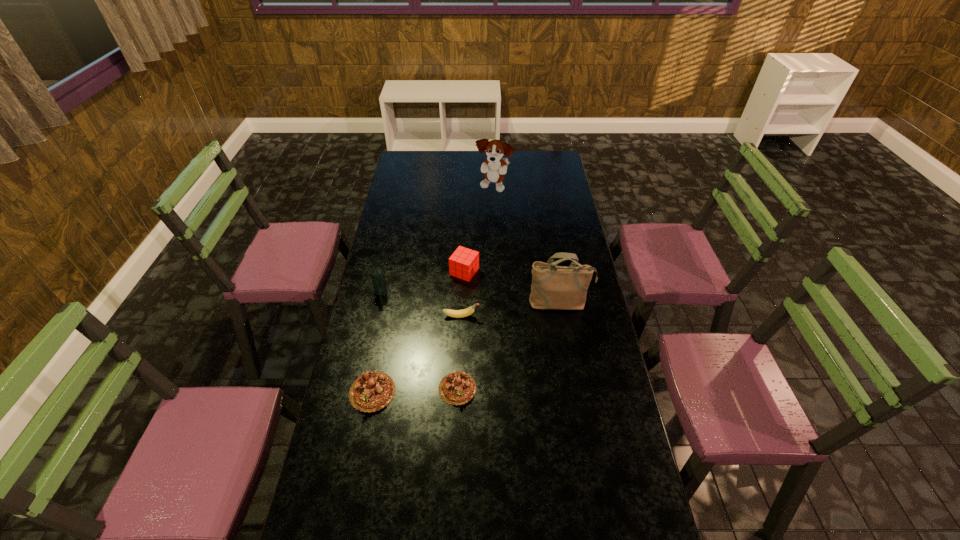
The chocolate cakes are evenly distributed in the image. To maintain this, where would you place another chocolate cake on the right? Please point to a free space. Please provide its 2D coordinates. Your answer should be formatted as a tuple, i.e. [(x, y)], where the tuple contains the x and y coordinates of a point satisfying the conditions above.

[(541, 385)]